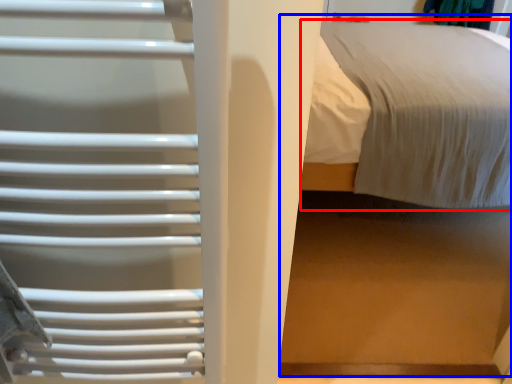
Question: Which of the following is the farthest to the observer, bed (highlighted by a red box) or bed (highlighted by a blue box)?

Choices:
 (A) bed
 (B) bed

Answer: (A)